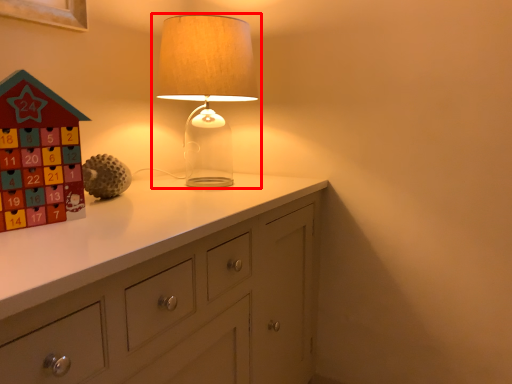
Question: Where is lamp (annotated by the red box) located in relation to toy in the image?

Choices:
 (A) right
 (B) left

Answer: (A)